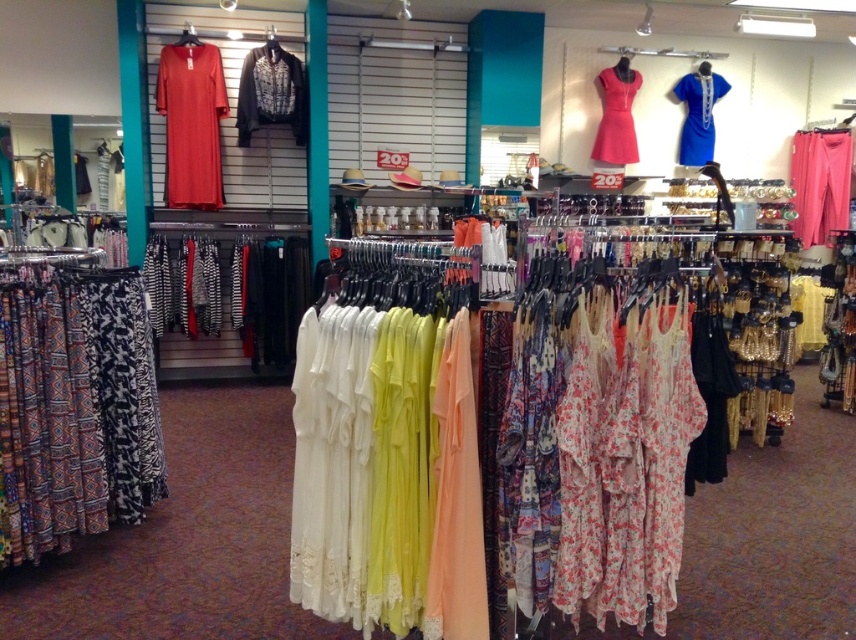
Is point (122, 284) less distant than point (619, 116)?

Yes.

Between point (48, 339) and point (603, 108), which one is positioned in front?

Point (48, 339) is in front.

Where is `printed cotton skirt at left`? This screenshot has width=856, height=640. printed cotton skirt at left is located at coordinates (74, 408).

Which is in front, point (46, 372) or point (286, 65)?

Point (46, 372) is in front.

Is printed cotton skirt at left thinner than black sequined blouse at upper center?

Correct, printed cotton skirt at left's width is less than black sequined blouse at upper center's.

Which is behind, point (4, 333) or point (271, 77)?

The point (271, 77) is behind.

Identify the location of printed cotton skirt at left. The height and width of the screenshot is (640, 856). (74, 408).

Between matte red dress at upper left and black sequined blouse at upper center, which one appears on the right side from the viewer's perspective?

Positioned to the right is black sequined blouse at upper center.

Between matte red dress at upper left and black sequined blouse at upper center, which one has more height?

Standing taller between the two is matte red dress at upper left.

Between point (175, 70) and point (278, 60), which one is positioned in front?

Positioned in front is point (175, 70).

Locate an element on the screen. Image resolution: width=856 pixels, height=640 pixels. matte red dress at upper left is located at coordinates (191, 124).